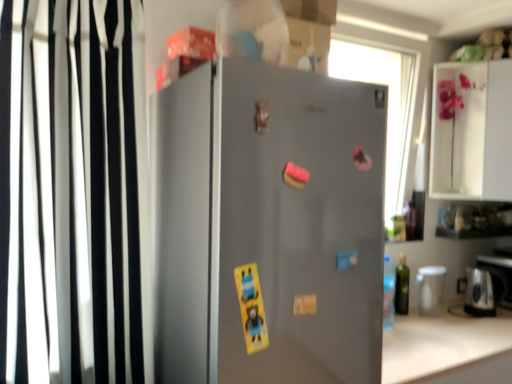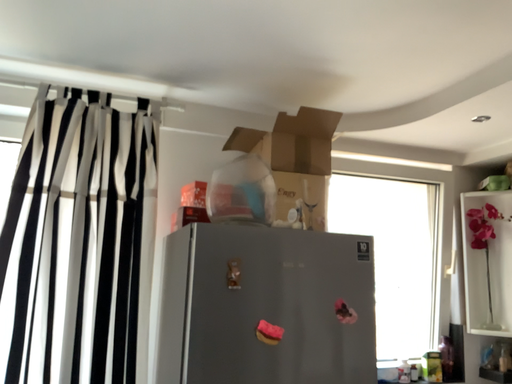
Question: Which way did the camera rotate in the video?

Choices:
 (A) rotated downward
 (B) rotated upward

Answer: (B)